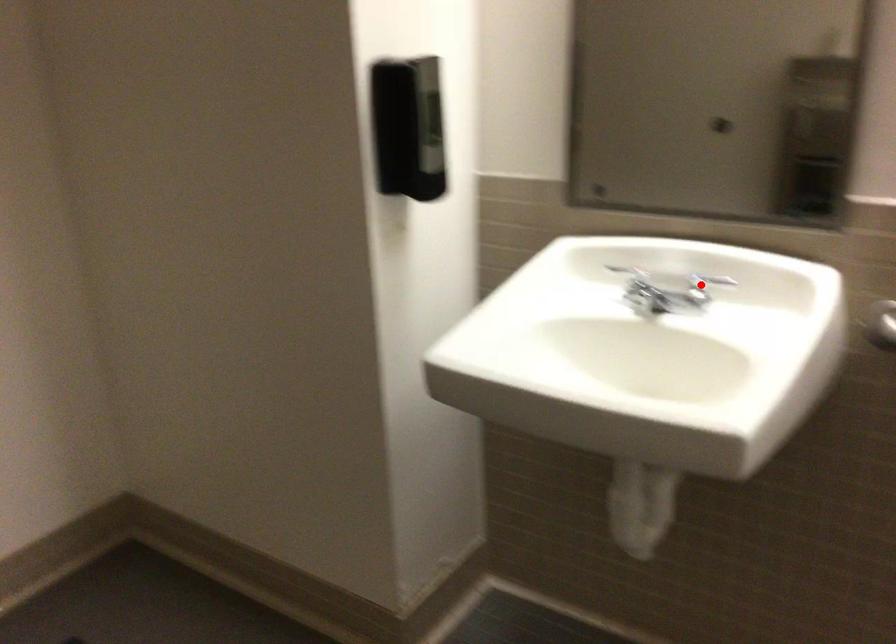
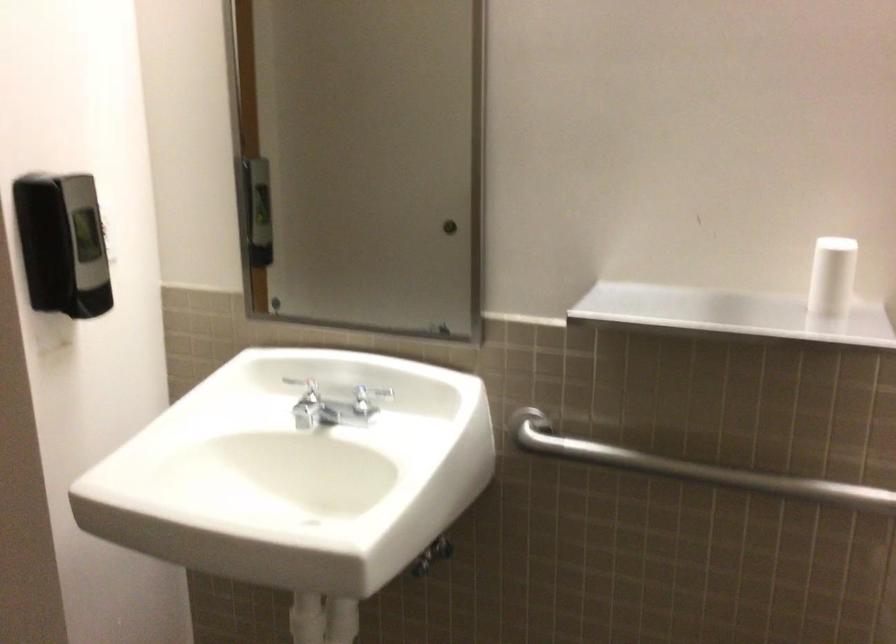
The point at the highlighted location is marked in the first image. Where is the corresponding point in the second image?

(368, 397)